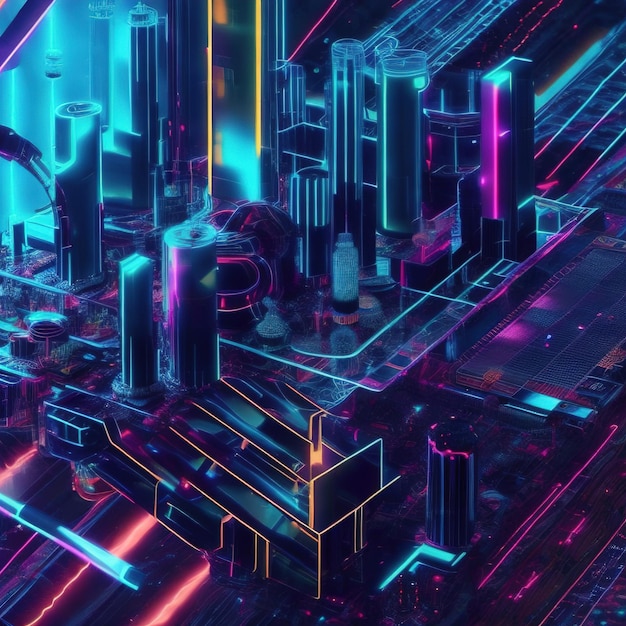
You are a GUI agent. You are given a task and a screenshot of the screen. Output one action in this format:
    pyautogui.click(x=<x>, y=<y>)
    Task: Click on the pink lights
    
    Given the screenshot: What is the action you would take?
    pyautogui.click(x=140, y=530), pyautogui.click(x=191, y=583), pyautogui.click(x=17, y=464)